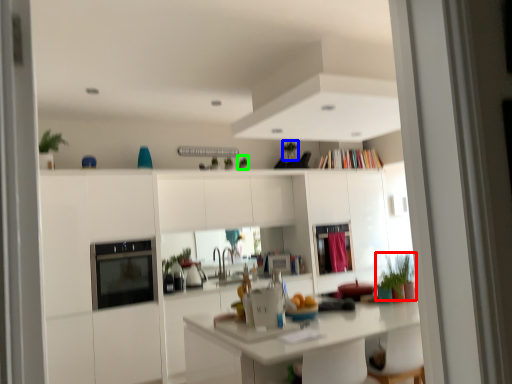
Question: Which object is positioned closest to plant (highlighted by a red box)? Select from plant (highlighted by a blue box) and plant (highlighted by a green box).

Choices:
 (A) plant
 (B) plant

Answer: (B)